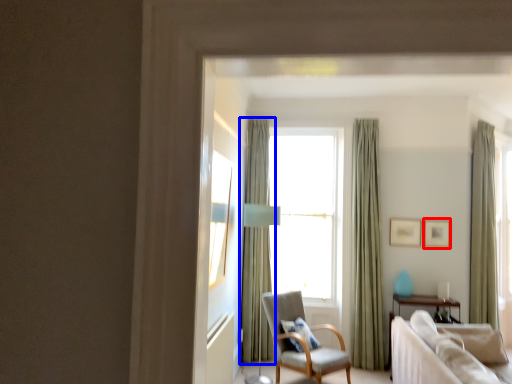
Question: Among these objects, which one is nearest to the camera, picture frame (highlighted by a red box) or curtain (highlighted by a blue box)?

Choices:
 (A) picture frame
 (B) curtain

Answer: (B)